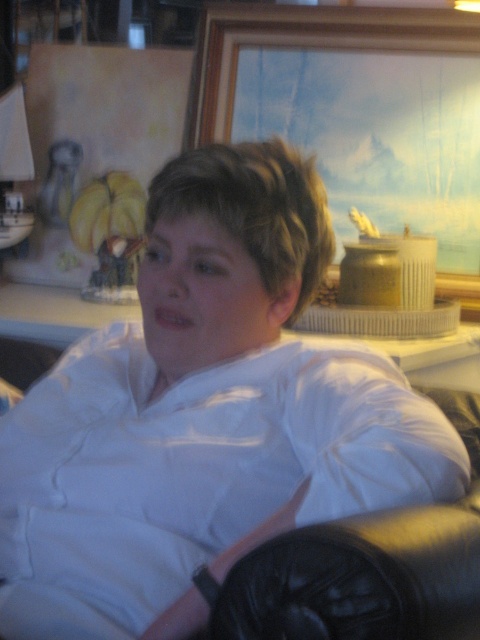
Question: Which point is farther to the camera?

Choices:
 (A) (79, 212)
 (B) (328, 45)

Answer: (A)

Question: Does wooden picture frame at upper center appear under yellow matte bananas at upper left?

Choices:
 (A) no
 (B) yes

Answer: (A)

Question: Does wooden picture frame at upper center appear under yellow matte bananas at upper left?

Choices:
 (A) no
 (B) yes

Answer: (A)

Question: Can you confirm if wooden picture frame at upper center is positioned to the right of yellow matte bananas at upper left?

Choices:
 (A) no
 (B) yes

Answer: (B)

Question: Among these objects, which one is nearest to the camera?

Choices:
 (A) wooden picture frame at upper center
 (B) yellow matte bananas at upper left

Answer: (A)